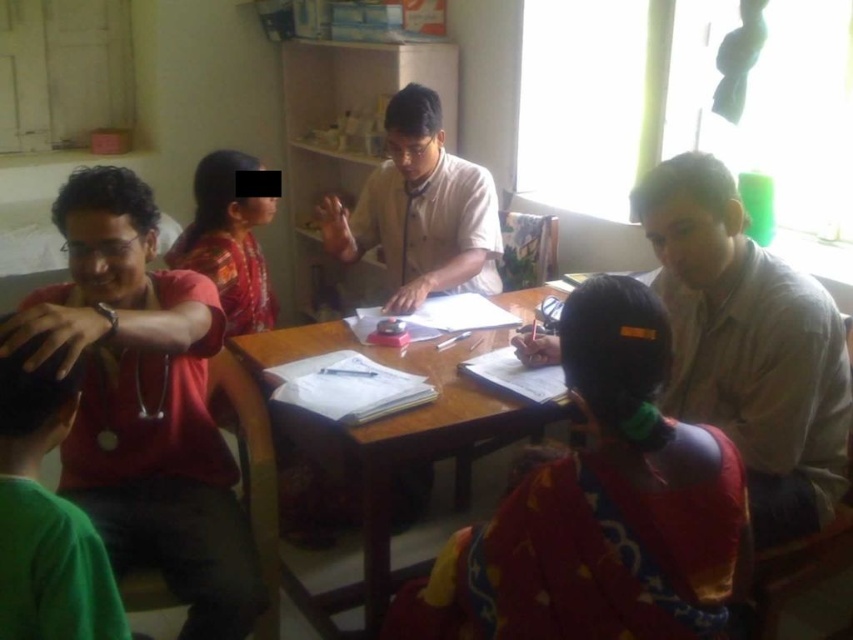
Between multicolored fabric sari at center and matte red shirt at left, which one has more height?

With more height is matte red shirt at left.

Which is more to the left, multicolored fabric sari at center or matte red shirt at left?

From the viewer's perspective, matte red shirt at left appears more on the left side.

This screenshot has height=640, width=853. Describe the element at coordinates (599, 508) in the screenshot. I see `multicolored fabric sari at center` at that location.

This screenshot has height=640, width=853. In order to click on multicolored fabric sari at center in this screenshot , I will do `click(599, 508)`.

Locate an element on the screen. The width and height of the screenshot is (853, 640). matte red shirt at left is located at coordinates tap(144, 403).

Looking at this image, who is lower down, matte red shirt at left or white matte shirt at center?

Positioned lower is matte red shirt at left.

Between point (114, 339) and point (410, 180), which one is positioned behind?

The point (410, 180) is more distant.

The width and height of the screenshot is (853, 640). I want to click on matte red shirt at left, so click(144, 403).

Can you confirm if light brown shirt at center is thinner than white matte shirt at center?

Correct, light brown shirt at center's width is less than white matte shirt at center's.

Which is above, light brown shirt at center or white matte shirt at center?

white matte shirt at center

Between point (817, 288) and point (457, 170), which one is positioned in front?

Point (817, 288) is in front.

Where is `light brown shirt at center`? This screenshot has width=853, height=640. light brown shirt at center is located at coordinates (747, 346).